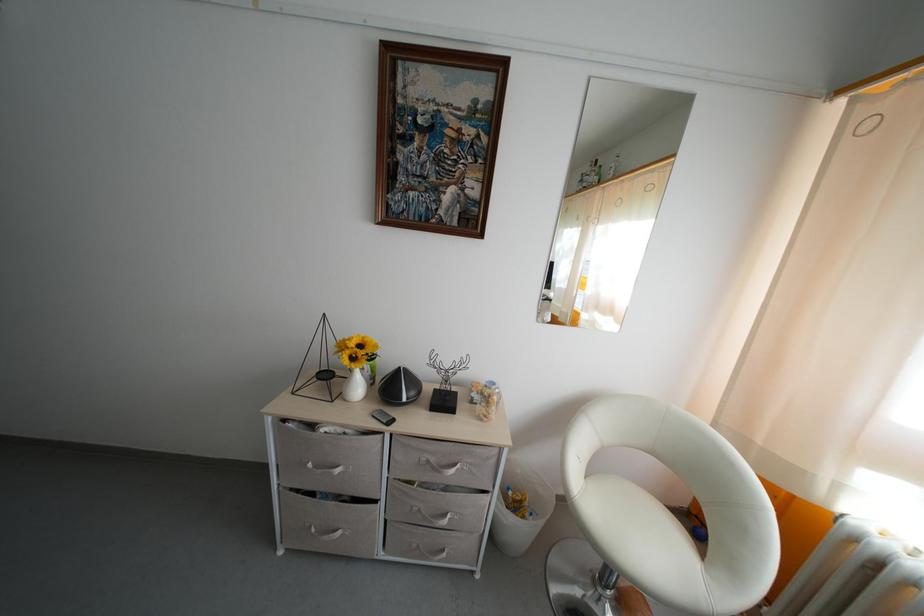
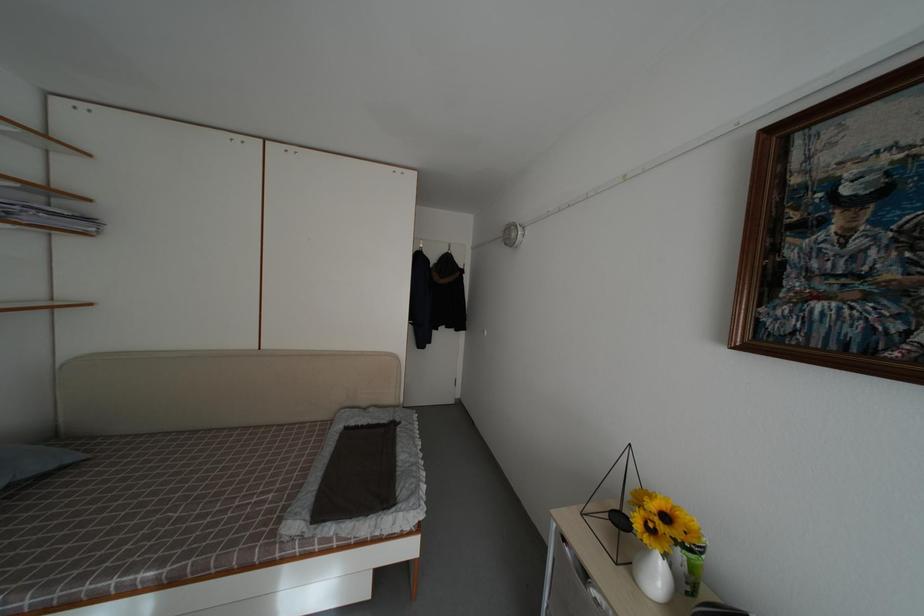
Find the pixel in the second image that matches [292,400] in the first image.

(581, 517)